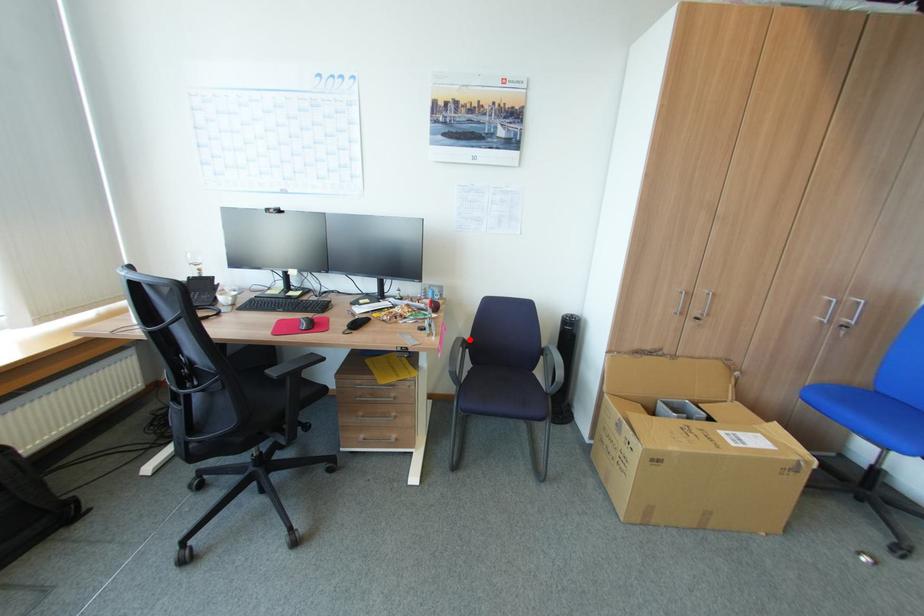
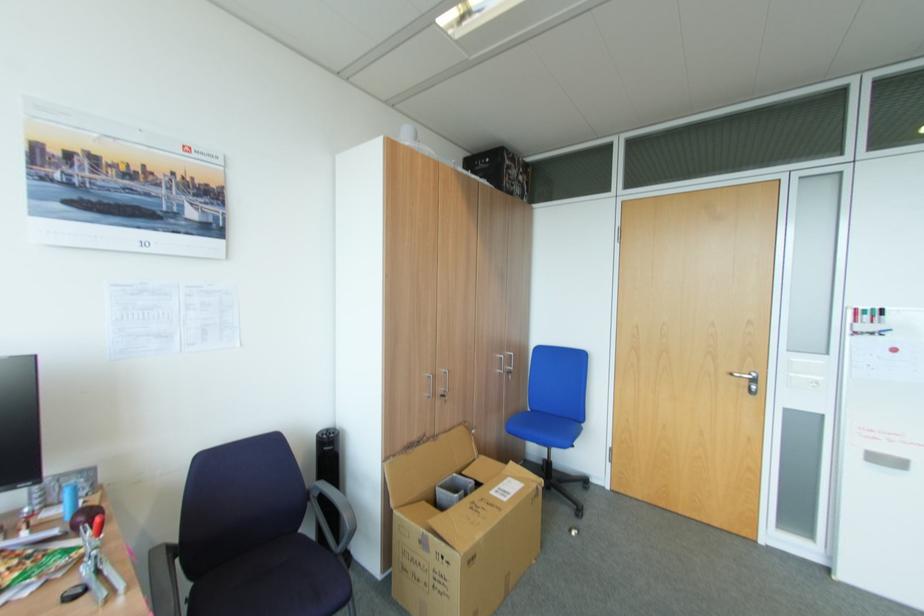
Question: I am providing you with two images of the same scene from different viewpoints. In image1, a red point is highlighted. Considering the same 3D point in image2, which of the following is correct?

Choices:
 (A) It is closer
 (B) It is farther

Answer: (B)